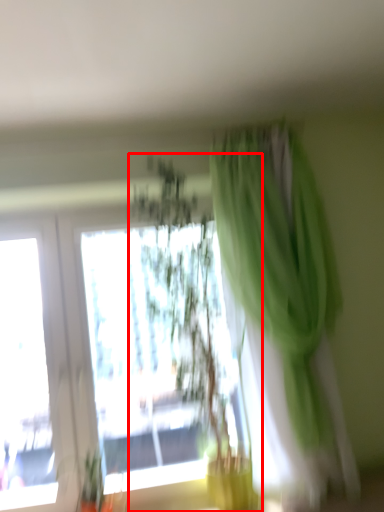
Question: In this image, where is houseplant (annotated by the red box) located relative to curtain?

Choices:
 (A) right
 (B) left

Answer: (B)